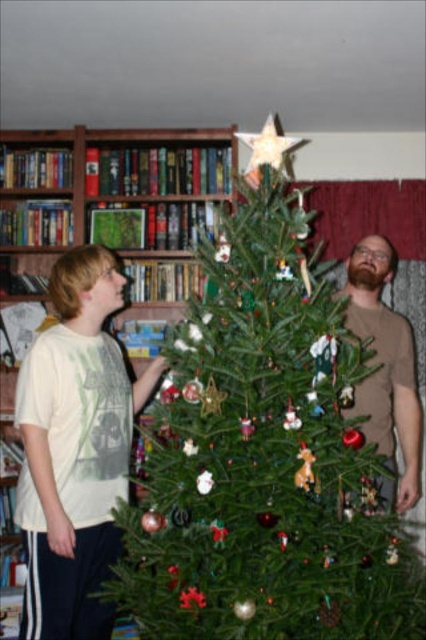
Question: Which of the following is the closest to the observer?

Choices:
 (A) green natural christmas tree at center
 (B) green matte bookcase at upper left

Answer: (A)

Question: Which object is the farthest from the green natural christmas tree at center?

Choices:
 (A) brown matte shirt at right
 (B) green matte bookcase at upper left

Answer: (B)

Question: Does green matte bookcase at upper left have a smaller size compared to white matte t-shirt at left?

Choices:
 (A) no
 (B) yes

Answer: (B)

Question: Which point is farther from the camera taking this photo?

Choices:
 (A) (172, 250)
 (B) (81, 512)
 (C) (402, 424)
 (D) (324, 324)

Answer: (A)

Question: Is green natural christmas tree at center smaller than brown matte shirt at right?

Choices:
 (A) no
 (B) yes

Answer: (A)

Question: Is green natural christmas tree at center smaller than brown matte shirt at right?

Choices:
 (A) no
 (B) yes

Answer: (A)